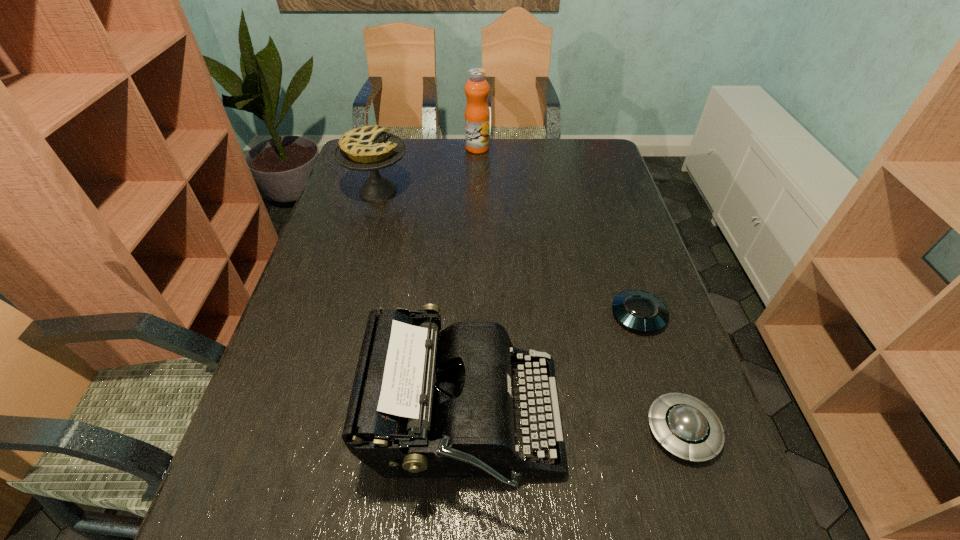
Find the location of a particular element. Image resolution: width=960 pixels, height=540 pixels. vacant space at the left edge of the desktop is located at coordinates (348, 264).

Find the location of a particular element. The image size is (960, 540). vacant region at the right edge of the desktop is located at coordinates (636, 442).

In the image, there is a desktop. What are the coordinates of `vacant space at the far right corner` in the screenshot? It's located at (590, 171).

You are a GUI agent. You are given a task and a screenshot of the screen. Output one action in this format:
    pyautogui.click(x=<x>, y=<y>)
    Task: Click on the empty space that is in between the taller saucer and the farther saucer
    The height and width of the screenshot is (540, 960).
    Given the screenshot: What is the action you would take?
    pyautogui.click(x=660, y=373)

At what (x,y) coordinates should I click in order to perform the action: click on blank region between the farthest object and the shortest object. Please return your answer as a coordinate pair (x, y). This screenshot has height=540, width=960. Looking at the image, I should click on (x=558, y=232).

Find the location of a particular element. The height and width of the screenshot is (540, 960). free point between the second farthest object and the fruit juice is located at coordinates (428, 170).

Locate an element on the screen. Image resolution: width=960 pixels, height=540 pixels. empty space between the farthest object and the second shortest object is located at coordinates (580, 289).

I want to click on unoccupied area between the typewriter and the taller saucer, so click(x=573, y=426).

Where is `vacant area that lies between the tallest object and the second farthest object`? vacant area that lies between the tallest object and the second farthest object is located at coordinates click(x=428, y=170).

Locate an element on the screen. The image size is (960, 540). free spot between the fruit juice and the fourth tallest object is located at coordinates (580, 289).